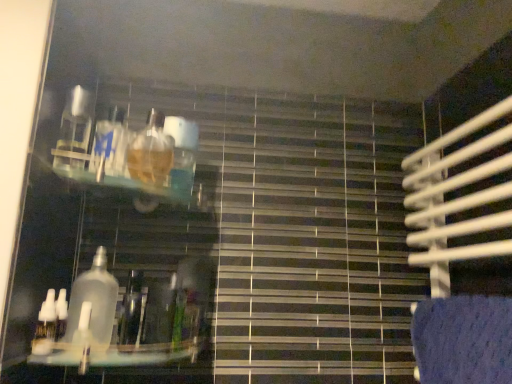
Question: Which direction should I rotate to look at clear glass bottle at center, the second bottle positioned from the left, — up or down?

Choices:
 (A) down
 (B) up

Answer: (A)

Question: From a real-world perspective, does clear plastic bottle at lower left, which appears as the 2th bottle when viewed from the right, sit lower than clear glass bottle at center, the second bottle positioned from the left?

Choices:
 (A) no
 (B) yes

Answer: (B)

Question: From the image's perspective, is clear plastic bottle at lower left, which appears as the 2th bottle when viewed from the right, over clear glass bottle at center, which is the 1th bottle in right-to-left order?

Choices:
 (A) no
 (B) yes

Answer: (A)

Question: Is clear plastic bottle at lower left, the 1th bottle positioned from the left, taller than clear glass bottle at center, which is the 1th bottle in right-to-left order?

Choices:
 (A) yes
 (B) no

Answer: (B)

Question: Is clear plastic bottle at lower left, which appears as the 2th bottle when viewed from the right, at the left side of clear glass bottle at center, the second bottle positioned from the left?

Choices:
 (A) yes
 (B) no

Answer: (A)

Question: Is clear plastic bottle at lower left, which appears as the 2th bottle when viewed from the right, thinner than clear glass bottle at center, which is the 1th bottle in right-to-left order?

Choices:
 (A) no
 (B) yes

Answer: (B)

Question: Is clear plastic bottle at lower left, the 1th bottle positioned from the left, looking in the opposite direction of clear glass bottle at center, which is the 1th bottle in right-to-left order?

Choices:
 (A) yes
 (B) no

Answer: (B)

Question: Is clear glass bottle at center, which is the 1th bottle in right-to-left order, wider than clear plastic bottle at lower left, which appears as the 2th bottle when viewed from the right?

Choices:
 (A) yes
 (B) no

Answer: (A)

Question: Considering the relative sizes of clear glass bottle at center, which is the 1th bottle in right-to-left order, and clear plastic bottle at lower left, the 1th bottle positioned from the left, in the image provided, is clear glass bottle at center, which is the 1th bottle in right-to-left order, shorter than clear plastic bottle at lower left, the 1th bottle positioned from the left,?

Choices:
 (A) yes
 (B) no

Answer: (B)

Question: Considering the relative sizes of clear glass bottle at center, which is the 1th bottle in right-to-left order, and clear plastic bottle at lower left, which appears as the 2th bottle when viewed from the right, in the image provided, is clear glass bottle at center, which is the 1th bottle in right-to-left order, thinner than clear plastic bottle at lower left, which appears as the 2th bottle when viewed from the right,?

Choices:
 (A) yes
 (B) no

Answer: (B)

Question: From a real-world perspective, is clear glass bottle at center, the second bottle positioned from the left, under clear plastic bottle at lower left, which appears as the 2th bottle when viewed from the right?

Choices:
 (A) yes
 (B) no

Answer: (B)

Question: Can you confirm if clear glass bottle at center, the second bottle positioned from the left, is bigger than clear plastic bottle at lower left, the 1th bottle positioned from the left?

Choices:
 (A) no
 (B) yes

Answer: (B)

Question: From the image's perspective, would you say clear glass bottle at center, which is the 1th bottle in right-to-left order, is positioned over clear plastic bottle at lower left, the 1th bottle positioned from the left?

Choices:
 (A) no
 (B) yes

Answer: (B)

Question: From a real-world perspective, is clear glass bottle at center, the second bottle positioned from the left, above or below clear plastic bottle at lower left, which appears as the 2th bottle when viewed from the right?

Choices:
 (A) above
 (B) below

Answer: (A)